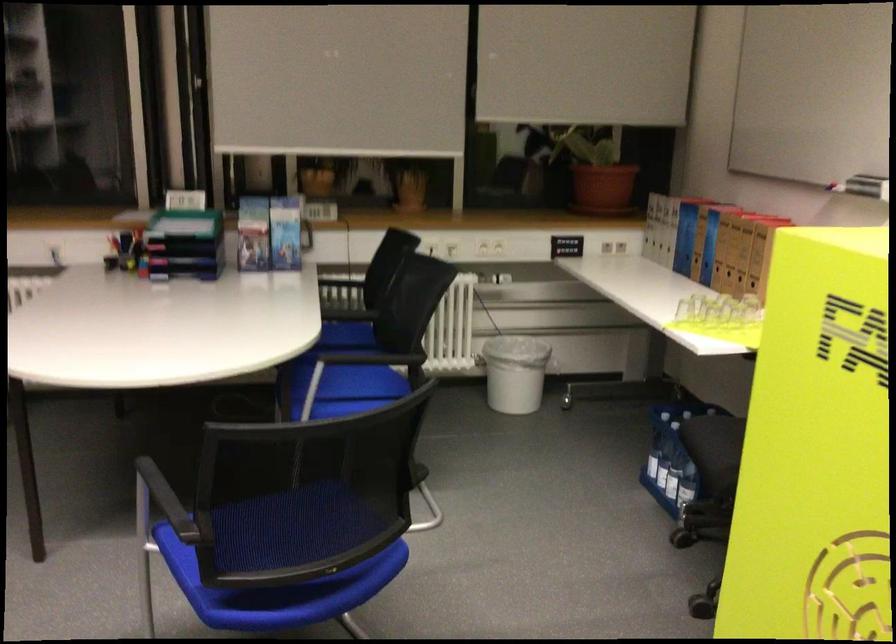
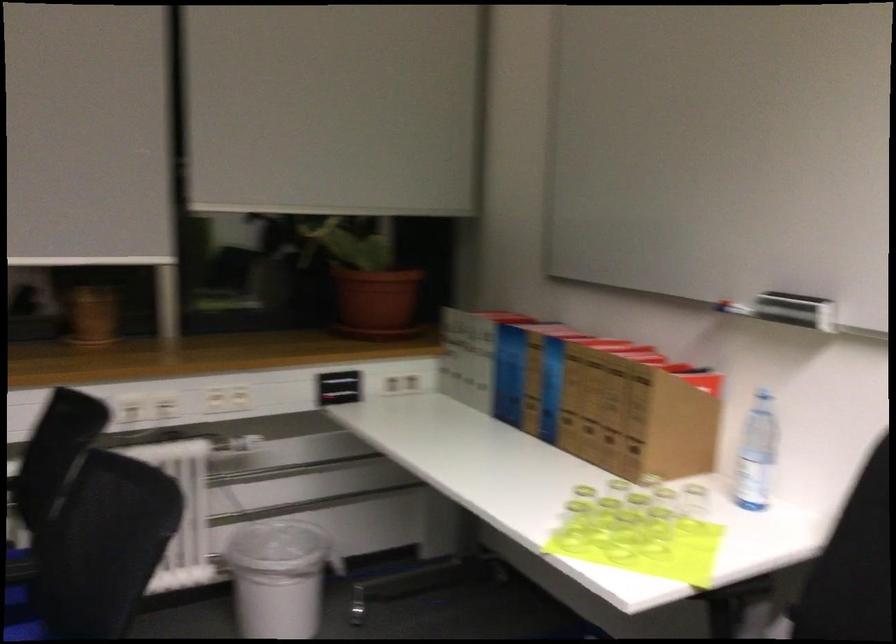
Locate, in the second image, the point that corresponds to pixel 721 322 in the first image.

(623, 536)